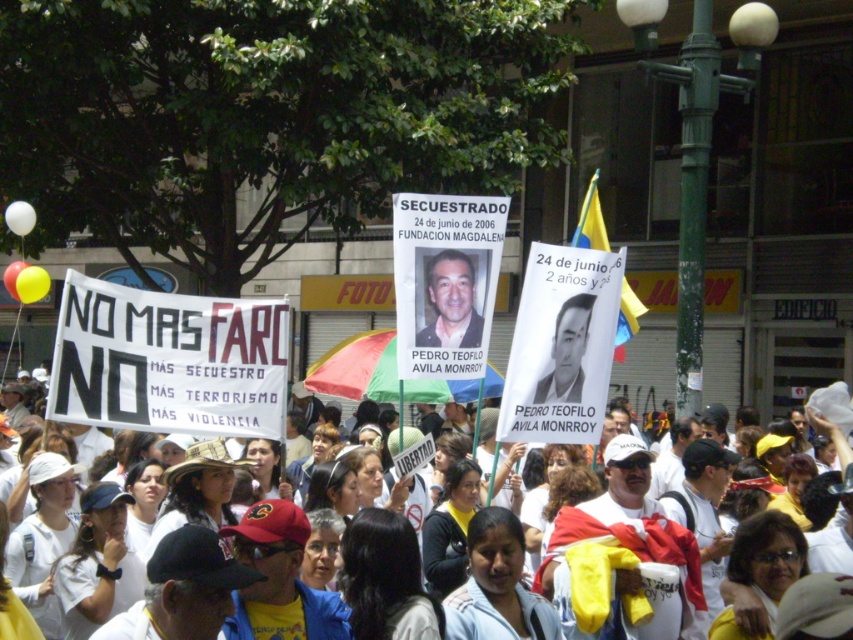
Between matte black photo at center and black matte poster at center, which one appears on the left side from the viewer's perspective?

matte black photo at center

Is matte black photo at center shorter than black matte poster at center?

Yes, matte black photo at center is shorter than black matte poster at center.

Does point (463, 266) come in front of point (561, 385)?

No, (463, 266) is behind (561, 385).

The width and height of the screenshot is (853, 640). In order to click on matte black photo at center in this screenshot , I will do `click(450, 301)`.

Can you confirm if black matte poster at center is wider than white paper sign at center?

No, black matte poster at center is not wider than white paper sign at center.

Does point (582, 300) lie in front of point (816, 396)?

That is True.

This screenshot has height=640, width=853. I want to click on black matte poster at center, so click(567, 353).

Can you confirm if matte black photo at center is positioned to the right of white paper sign at center?

No, matte black photo at center is not to the right of white paper sign at center.

Is matte black photo at center below white paper sign at center?

Incorrect, matte black photo at center is not positioned below white paper sign at center.

I want to click on matte black photo at center, so click(450, 301).

The image size is (853, 640). Identify the location of matte black photo at center. (450, 301).